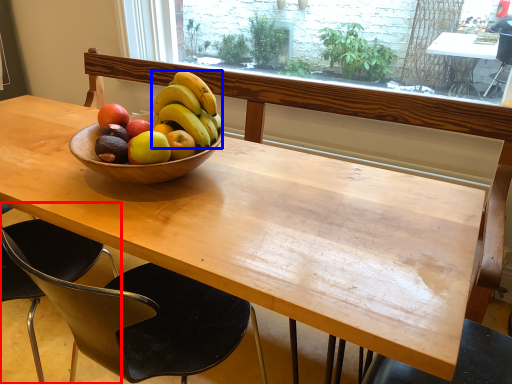
Question: Which object is closer to the camera taking this photo, chair (highlighted by a red box) or banana (highlighted by a blue box)?

Choices:
 (A) chair
 (B) banana

Answer: (A)